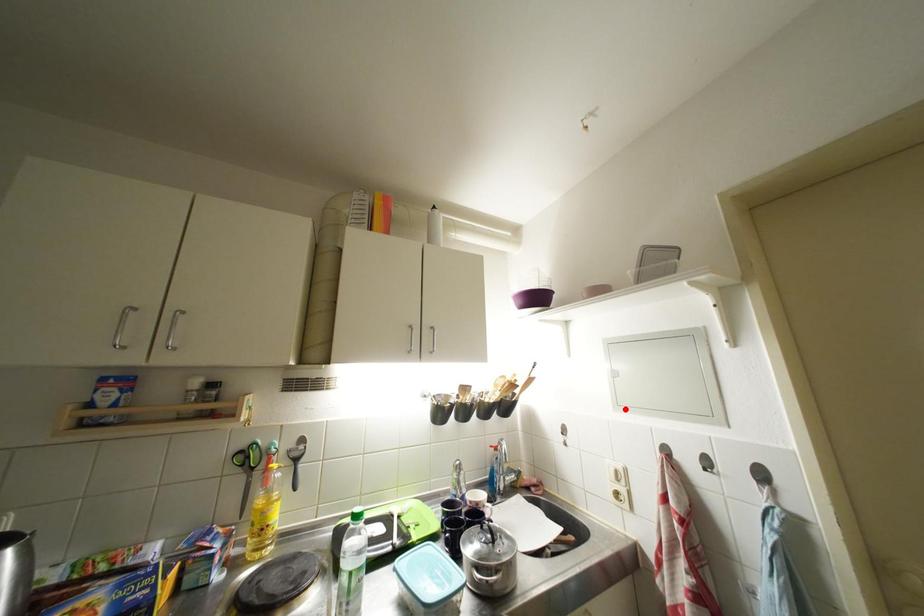
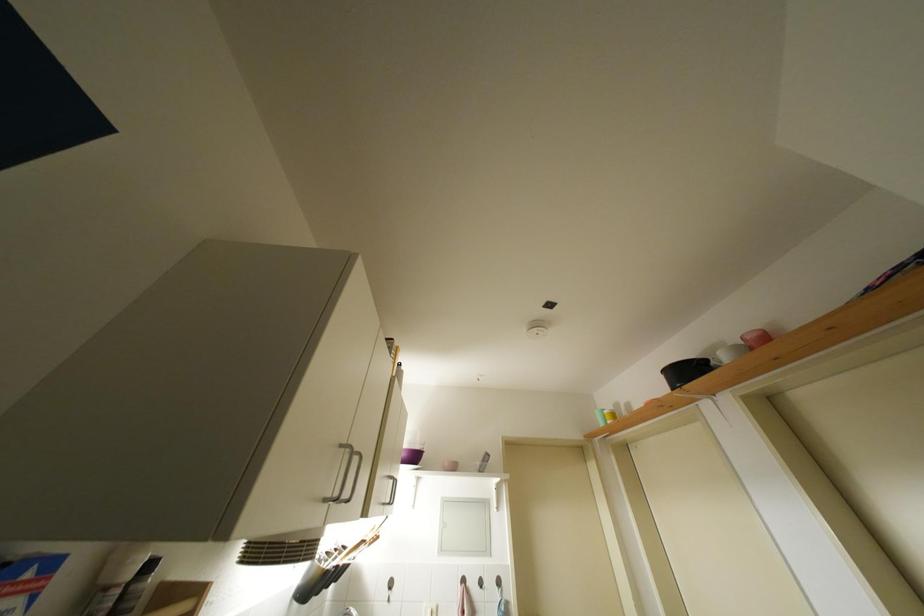
Find the pixel in the second image that matches the highlighted location in the first image.

(447, 554)